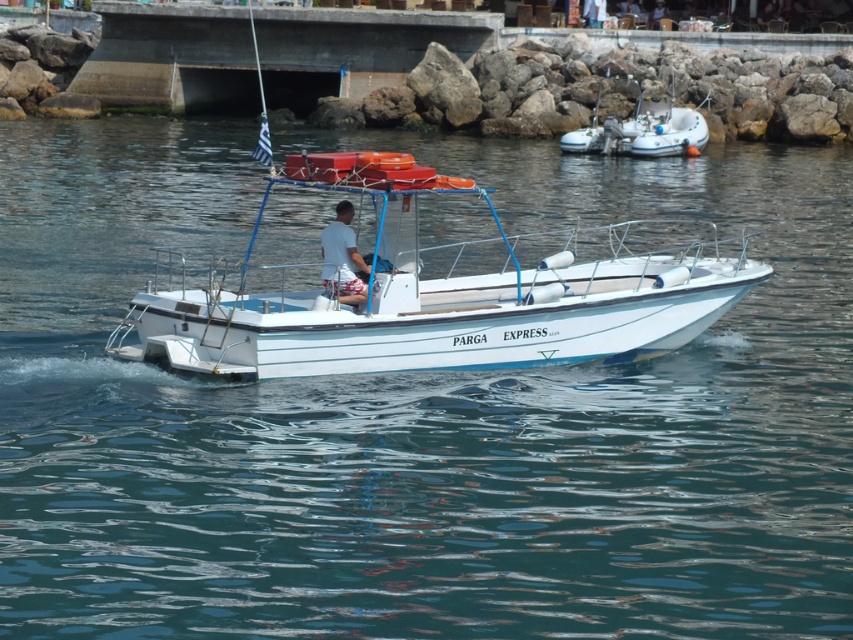
Is point (577, 147) farther from camera compared to point (343, 218)?

Yes.

Who is positioned more to the right, white rubber dinghy at upper right or white printed shorts at center?

From the viewer's perspective, white rubber dinghy at upper right appears more on the right side.

Measure the distance between point (639, 154) and camera.

The distance of point (639, 154) from camera is 162.64 feet.

Where is `white rubber dinghy at upper right`? white rubber dinghy at upper right is located at coordinates (642, 131).

Is point (277, 332) farther from viewer compared to point (612, 122)?

No, (277, 332) is closer to viewer.

What do you see at coordinates (448, 304) in the screenshot? Image resolution: width=853 pixels, height=640 pixels. I see `white matte boat at center` at bounding box center [448, 304].

At what (x,y) coordinates should I click in order to perform the action: click on white matte boat at center. Please return your answer as a coordinate pair (x, y). The image size is (853, 640). Looking at the image, I should click on (448, 304).

Where is `white matte boat at center`? This screenshot has width=853, height=640. white matte boat at center is located at coordinates (448, 304).

Between white matte boat at center and white printed shorts at center, which one is positioned higher?

white matte boat at center is above.

Find the location of `white matte boat at center`. white matte boat at center is located at coordinates (448, 304).